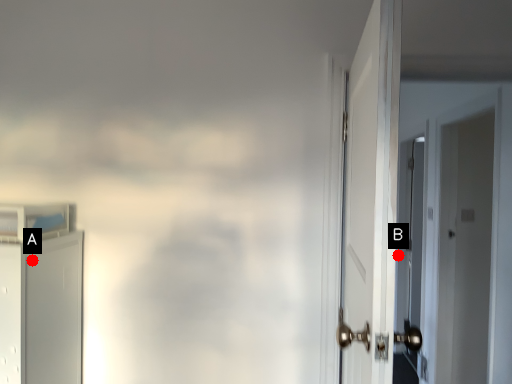
Question: Two points are circled on the image, labeled by A and B beside each circle. Which point appears closest to the camera in this image?

Choices:
 (A) A is closer
 (B) B is closer

Answer: (A)